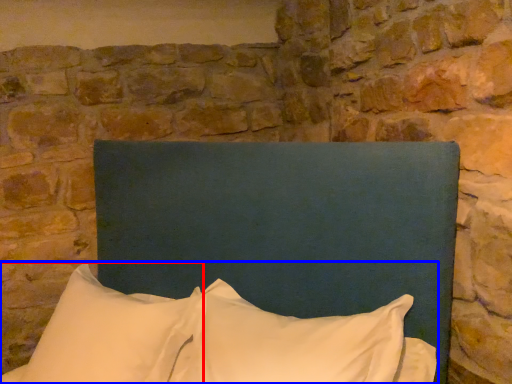
Question: Which object is closer to the camera taking this photo, pillow (highlighted by a red box) or pillow (highlighted by a blue box)?

Choices:
 (A) pillow
 (B) pillow

Answer: (B)